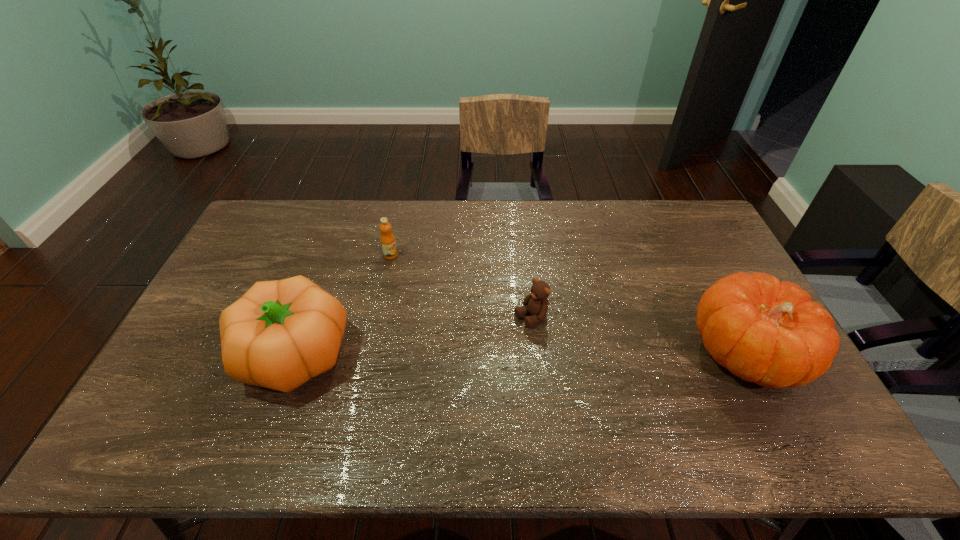
This screenshot has height=540, width=960. What are the coordinates of `the third closest object relative to the shortest object` in the screenshot? It's located at (280, 334).

Point out which object is positioned as the nearest to the third object from right to left. Please provide its 2D coordinates. Your answer should be formatted as a tuple, i.e. [(x, y)], where the tuple contains the x and y coordinates of a point satisfying the conditions above.

[(280, 334)]

The image size is (960, 540). I want to click on blank space that satisfies the following two spatial constraints: 1. on the front side of the third object from left to right; 2. on the right side of the right pumpkin, so click(535, 354).